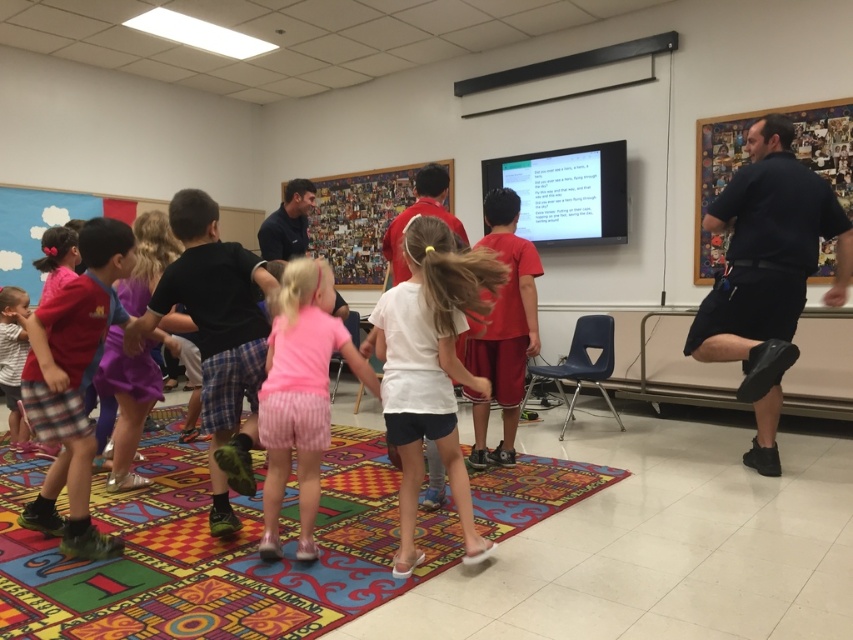
Question: Based on their relative distances, which object is nearer to the purple fabric skirt at center?

Choices:
 (A) matte pink shirt at center
 (B) dark blue shirt at upper right
 (C) wooden collage at center

Answer: (A)

Question: Is matte pink shirt at center above pink striped shorts at center?

Choices:
 (A) no
 (B) yes

Answer: (B)

Question: Estimate the real-world distances between objects in this image. Which object is closer to the multicolored carpet at center?

Choices:
 (A) white matte shirt at center
 (B) wooden collage at center
 (C) wooden bulletin board at upper right

Answer: (A)

Question: Which object is closer to the camera taking this photo?

Choices:
 (A) pink striped shorts at center
 (B) wooden collage at center
 (C) white matte shirt at center
 (D) wooden bulletin board at upper right

Answer: (C)

Question: Can you confirm if multicolored carpet at center is bigger than pink striped shorts at center?

Choices:
 (A) no
 (B) yes

Answer: (B)

Question: Does matte pink shirt at center appear on the left side of wooden collage at center?

Choices:
 (A) yes
 (B) no

Answer: (A)